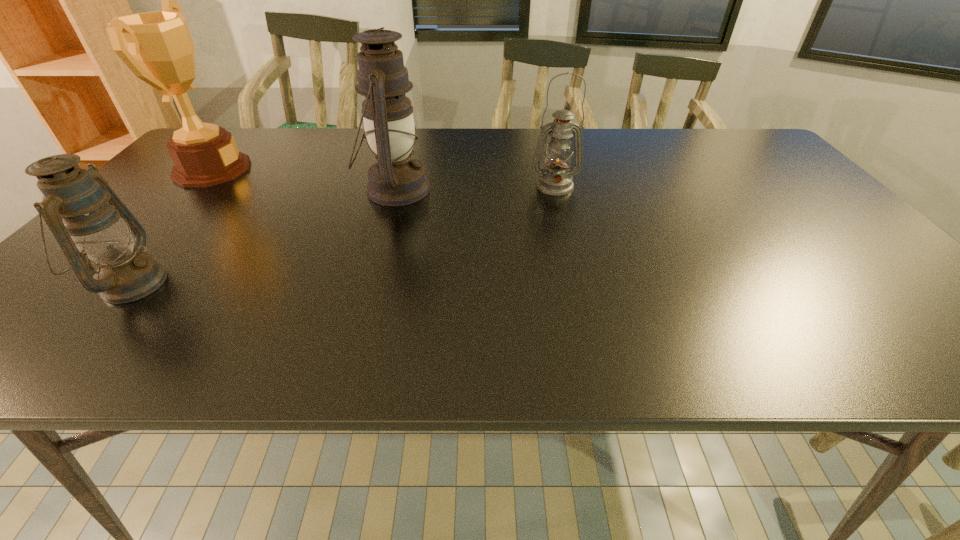
Where is `free space that satisfies the following two spatial constraints: 1. on the front-facing side of the award; 2. on the right side of the tallest oil lamp`? The height and width of the screenshot is (540, 960). free space that satisfies the following two spatial constraints: 1. on the front-facing side of the award; 2. on the right side of the tallest oil lamp is located at coordinates (194, 190).

The image size is (960, 540). In order to click on vacant space that satisfies the following two spatial constraints: 1. on the front-facing side of the rightmost oil lamp; 2. on the left side of the award in this screenshot , I will do `click(197, 186)`.

This screenshot has width=960, height=540. In order to click on blank area in the image that satisfies the following two spatial constraints: 1. on the front-facing side of the award; 2. on the left side of the nearest object in this screenshot , I will do `click(108, 284)`.

Image resolution: width=960 pixels, height=540 pixels. In order to click on vacant region that satisfies the following two spatial constraints: 1. on the front-facing side of the award; 2. on the right side of the nearest oil lamp in this screenshot , I will do `click(108, 284)`.